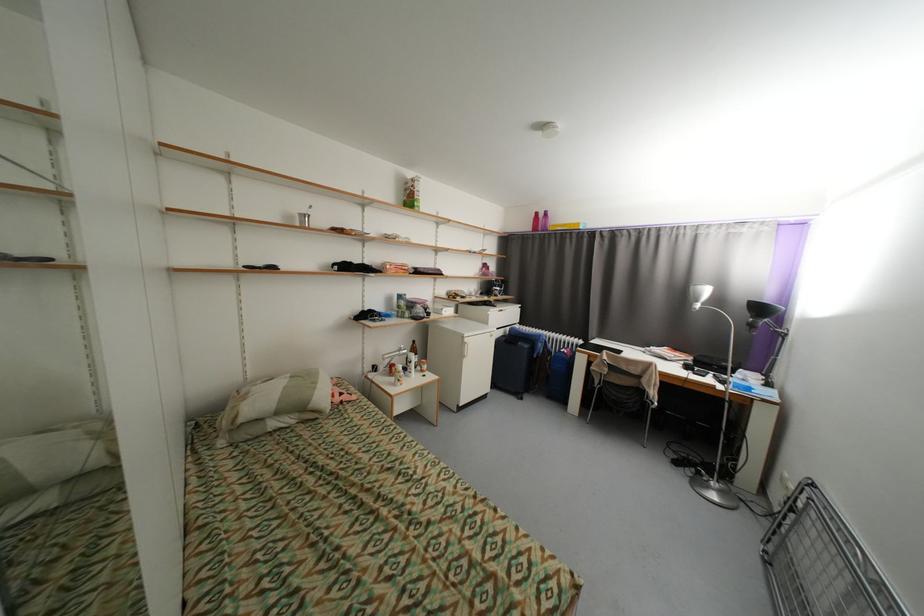
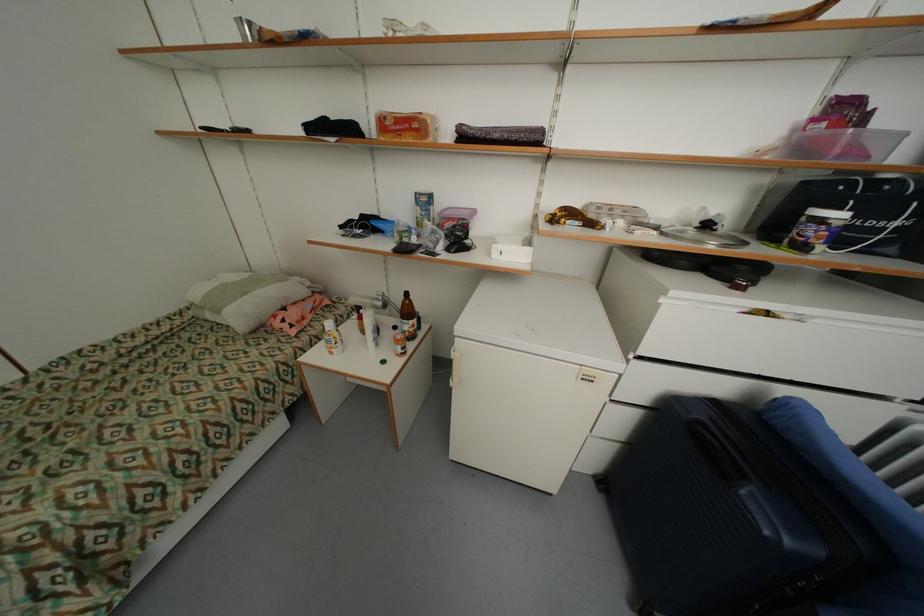
Find the pixel in the second image that matches point (488, 294) in the first image.

(713, 227)